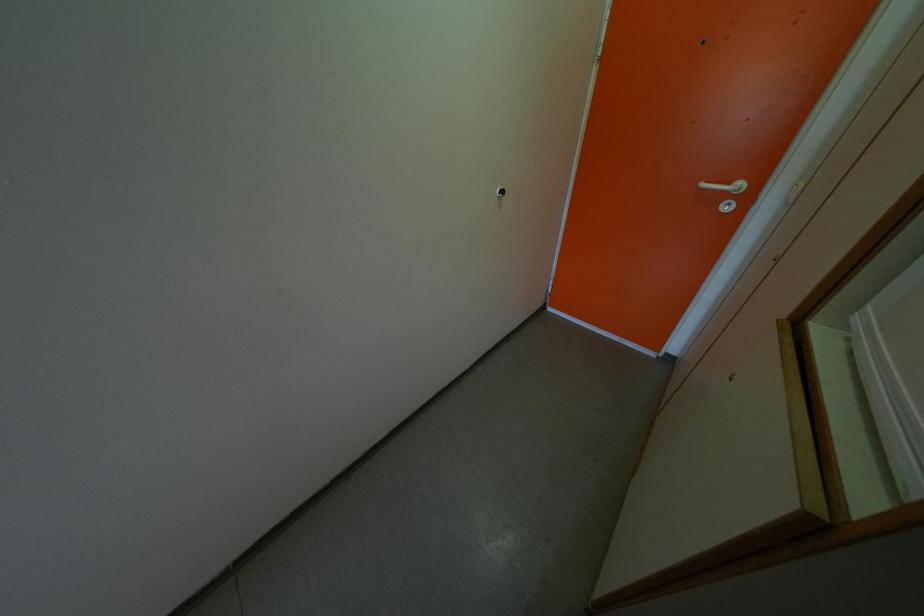
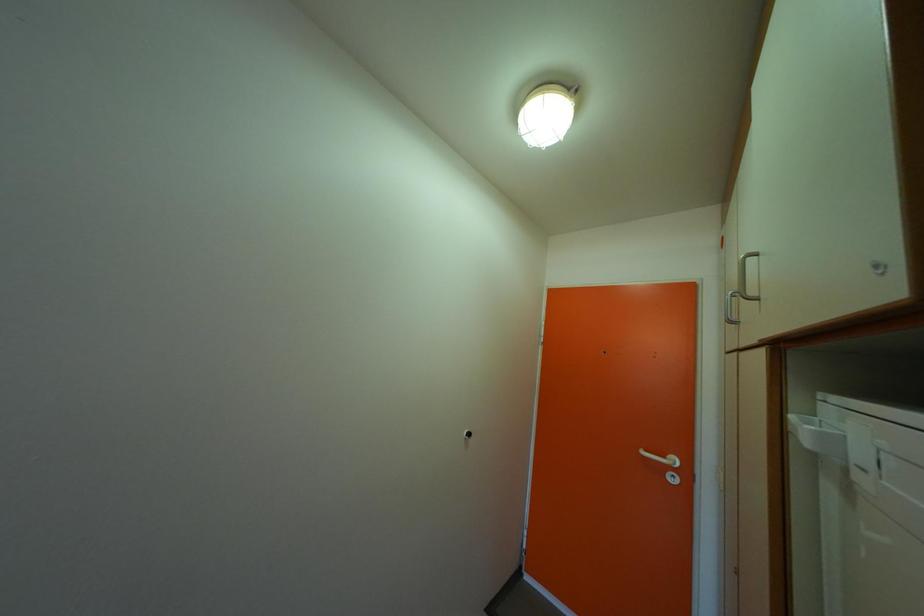
Question: Based on the continuous images, in which direction is the camera rotating? Reply with the corresponding letter.

Choices:
 (A) Left
 (B) Right
 (C) Up
 (D) Down

Answer: (C)